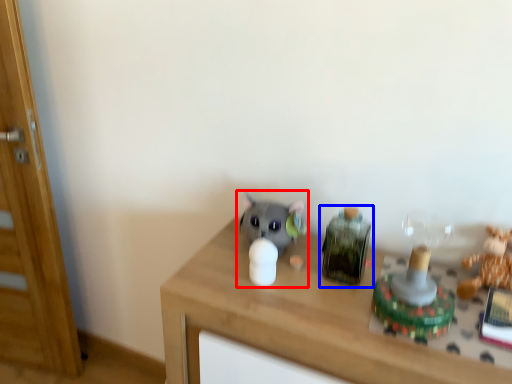
Question: Among these objects, which one is farthest to the camera, toy (highlighted by a red box) or toy (highlighted by a blue box)?

Choices:
 (A) toy
 (B) toy

Answer: (A)